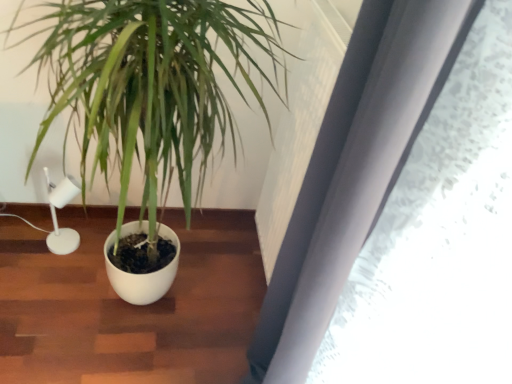
Where is `vacant space behind white matte lamp at left`? This screenshot has height=384, width=512. vacant space behind white matte lamp at left is located at coordinates (79, 218).